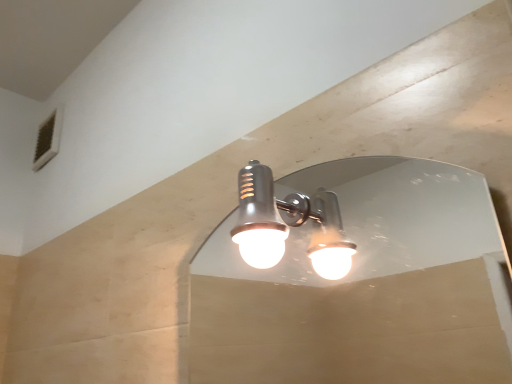
In order to face satin nickel light fixture at center, should I rotate leftwards or rightwards?

You should look right and rotate roughly 2.548 degrees.

The height and width of the screenshot is (384, 512). Identify the location of satin nickel light fixture at center. (288, 224).

Describe the element at coordinates (288, 224) in the screenshot. This screenshot has width=512, height=384. I see `satin nickel light fixture at center` at that location.

Locate an element on the screen. satin nickel light fixture at center is located at coordinates (288, 224).